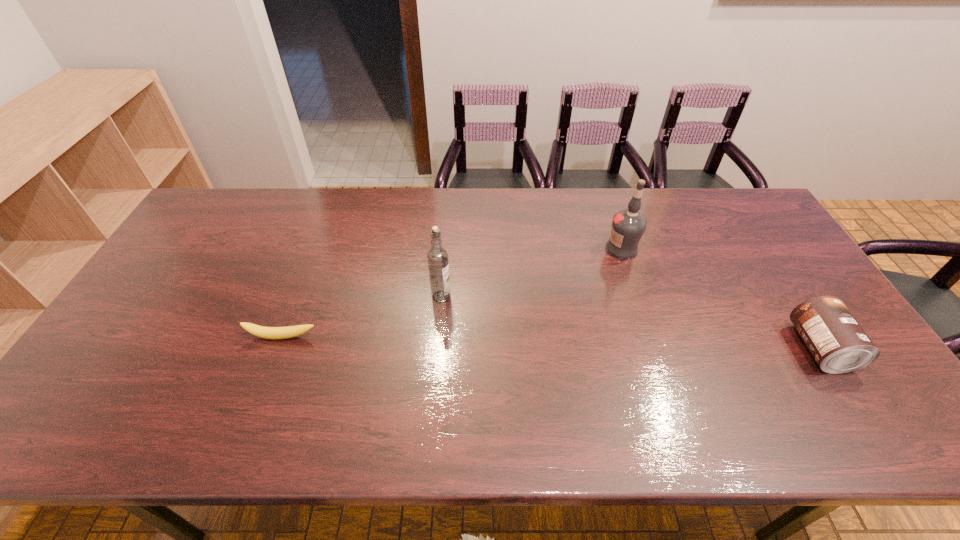
This screenshot has width=960, height=540. I want to click on free spot that satisfies the following two spatial constraints: 1. on the upward curve of the rightmost object; 2. on the front label of the shortest object, so [x=278, y=348].

I want to click on vacant point that satisfies the following two spatial constraints: 1. on the upward curve of the can; 2. on the front label of the banana, so click(x=278, y=348).